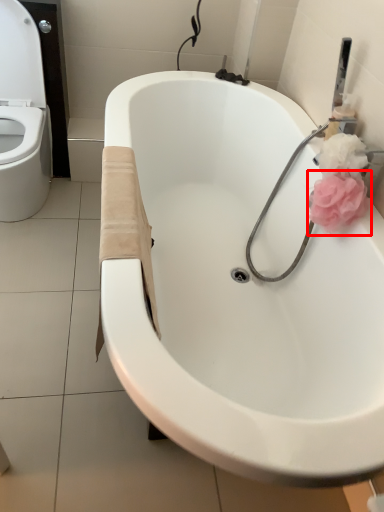
Question: Considering the relative positions of rose (annotated by the red box) and bathtub in the image provided, where is rose (annotated by the red box) located with respect to the staircase?

Choices:
 (A) left
 (B) right

Answer: (B)